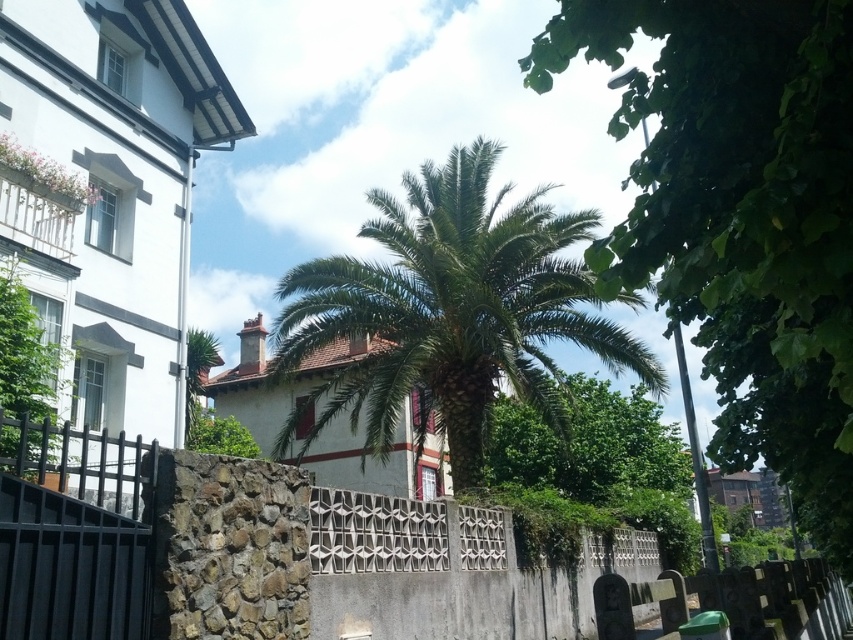
Question: Can you confirm if black metal gate at lower left is positioned to the right of white stone fence at lower right?

Choices:
 (A) no
 (B) yes

Answer: (A)

Question: Is green leafy palm at center thinner than black metal gate at lower left?

Choices:
 (A) yes
 (B) no

Answer: (B)

Question: Which of these objects is positioned farthest from the stone textured fence at center?

Choices:
 (A) black metal gate at lower left
 (B) green leafy tree at center
 (C) green leafy palm at center
 (D) white stone fence at lower right

Answer: (C)

Question: Which object is farther from the camera taking this photo?

Choices:
 (A) white stone fence at lower right
 (B) stone textured fence at center
 (C) black metal gate at lower left
 (D) green leafy palm at center

Answer: (D)

Question: Among these points, which one is nearest to the camera?

Choices:
 (A) (737, 326)
 (B) (814, 636)
 (C) (459, 636)

Answer: (A)

Question: Does green leafy tree at center appear over stone textured fence at center?

Choices:
 (A) no
 (B) yes

Answer: (B)